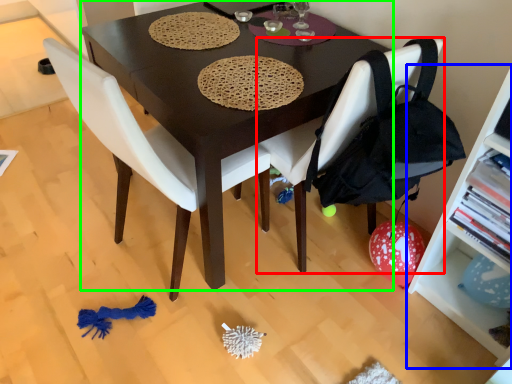
Question: Which object is positioned farthest from chair (highlighted by a red box)? Select from shelf (highlighted by a blue box) and desk (highlighted by a green box).

Choices:
 (A) shelf
 (B) desk

Answer: (A)